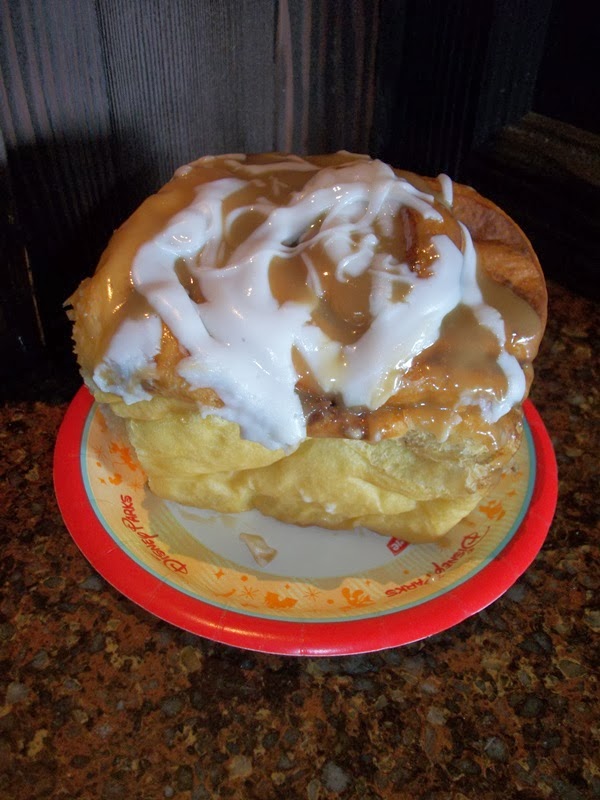
Where is `paper plate`? Image resolution: width=600 pixels, height=800 pixels. paper plate is located at coordinates (301, 552).